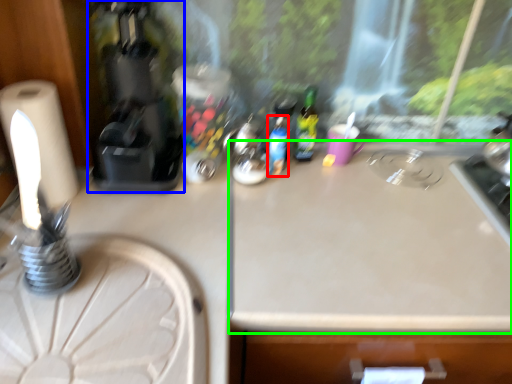
Question: Which object is positioned closest to bottle (highlighted by a red box)? Select from coffee machine (highlighted by a blue box) and counter top (highlighted by a green box).

Choices:
 (A) coffee machine
 (B) counter top

Answer: (B)